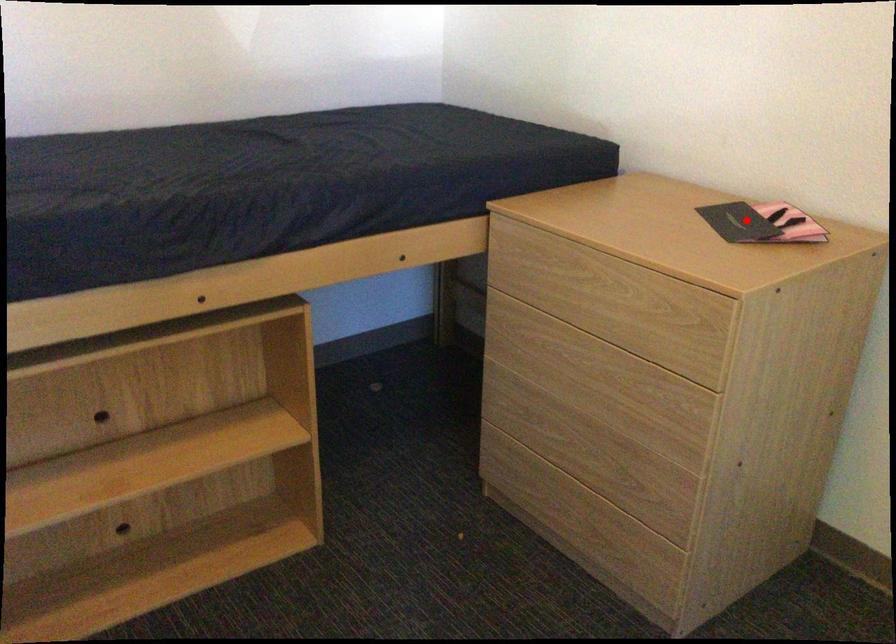
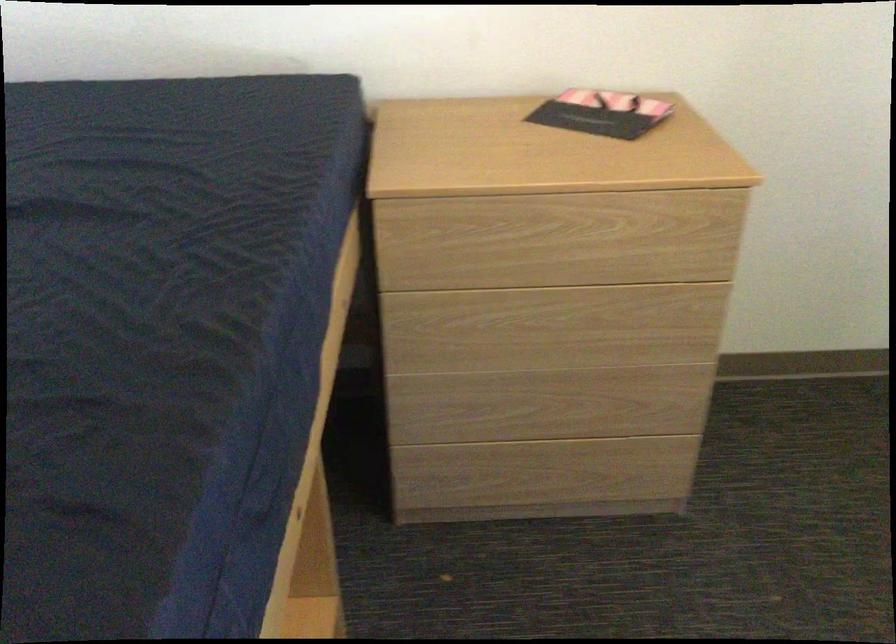
Where in the second image is the point corresponding to the highlighted location from the first image?

(600, 113)